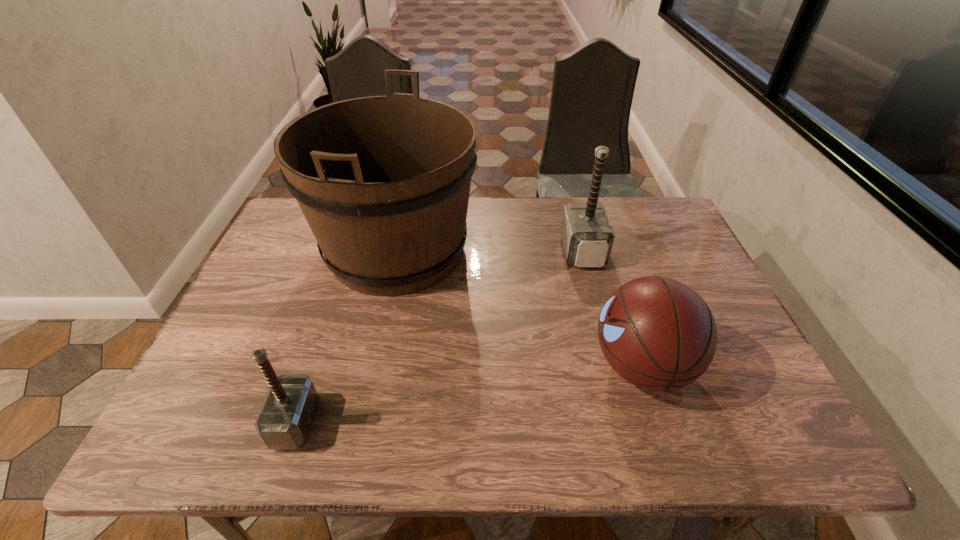
Identify the location of the tallest object. The height and width of the screenshot is (540, 960). (383, 181).

This screenshot has width=960, height=540. What are the coordinates of `the right hammer` in the screenshot? It's located at (587, 236).

The image size is (960, 540). Find the location of `the taller hammer`. the taller hammer is located at coordinates (587, 236).

This screenshot has width=960, height=540. Identify the location of basketball. (657, 333).

Locate an element on the screen. The image size is (960, 540). the shorter hammer is located at coordinates (285, 419).

Locate an element on the screen. the nearer hammer is located at coordinates (285, 419).

In order to click on vacant space located 0.050m on the left of the bucket in this screenshot , I will do `click(299, 249)`.

At what (x,y) coordinates should I click in order to perform the action: click on vacant area situated for striking with the head of the right hammer. Please return your answer as a coordinate pair (x, y). Looking at the image, I should click on (465, 251).

Find the location of a particular element. vacant space situated 0.280m for striking with the head of the right hammer is located at coordinates (468, 251).

Where is `free space located 0.290m for striking with the head of the right hammer`? free space located 0.290m for striking with the head of the right hammer is located at coordinates (465, 251).